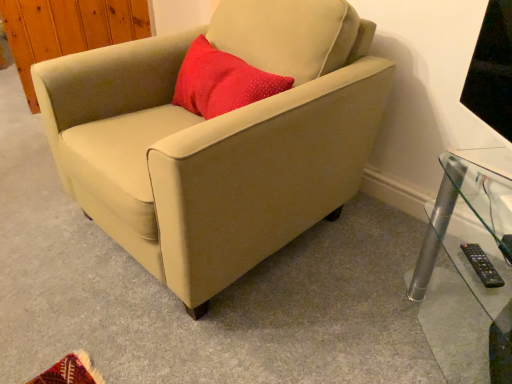
Question: Looking at their shapes, would you say beige fabric chair at center is wider or thinner than black plastic remote at lower right?

Choices:
 (A) wide
 (B) thin

Answer: (A)

Question: From a real-world perspective, is beige fabric chair at center above or below black plastic remote at lower right?

Choices:
 (A) below
 (B) above

Answer: (B)

Question: Estimate the real-world distances between objects in this image. Which object is farther from the black plastic remote at lower right?

Choices:
 (A) beige fabric chair at center
 (B) clear glass table at lower right

Answer: (A)

Question: Estimate the real-world distances between objects in this image. Which object is farther from the clear glass table at lower right?

Choices:
 (A) beige fabric chair at center
 (B) black plastic remote at lower right

Answer: (A)